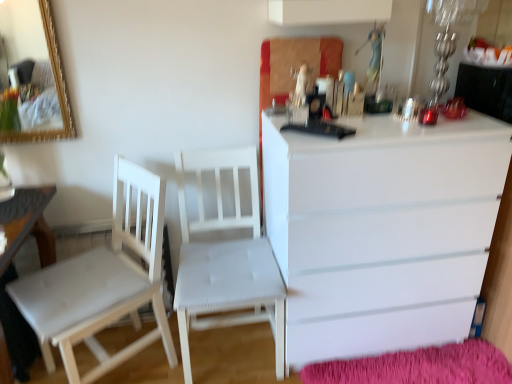
Question: Is white wood chair at center, arranged as the first chair when viewed from the left, positioned beyond the bounds of white fabric chair at center, the 1th chair from the right?

Choices:
 (A) no
 (B) yes

Answer: (B)

Question: Is white wood chair at center, arranged as the first chair when viewed from the left, bigger than white fabric chair at center, acting as the 2th chair starting from the left?

Choices:
 (A) yes
 (B) no

Answer: (A)

Question: From the image's perspective, is white wood chair at center, which is the 2th chair in right-to-left order, under white fabric chair at center, acting as the 2th chair starting from the left?

Choices:
 (A) yes
 (B) no

Answer: (A)

Question: Is the position of white wood chair at center, which is the 2th chair in right-to-left order, less distant than that of white fabric chair at center, the 1th chair from the right?

Choices:
 (A) yes
 (B) no

Answer: (A)

Question: From a real-world perspective, does white wood chair at center, arranged as the first chair when viewed from the left, sit lower than white fabric chair at center, the 1th chair from the right?

Choices:
 (A) no
 (B) yes

Answer: (B)

Question: Is white wood chair at center, which is the 2th chair in right-to-left order, not close to white fabric chair at center, acting as the 2th chair starting from the left?

Choices:
 (A) no
 (B) yes

Answer: (A)

Question: Does white glossy chest of drawers at right have a greater height compared to white wood chair at center, which is the 2th chair in right-to-left order?

Choices:
 (A) no
 (B) yes

Answer: (B)

Question: Can you confirm if white glossy chest of drawers at right is smaller than white wood chair at center, which is the 2th chair in right-to-left order?

Choices:
 (A) no
 (B) yes

Answer: (A)

Question: From a real-world perspective, is white glossy chest of drawers at right positioned over white wood chair at center, arranged as the first chair when viewed from the left, based on gravity?

Choices:
 (A) yes
 (B) no

Answer: (A)

Question: Considering the relative positions of white glossy chest of drawers at right and white wood chair at center, which is the 2th chair in right-to-left order, in the image provided, is white glossy chest of drawers at right to the left of white wood chair at center, which is the 2th chair in right-to-left order, from the viewer's perspective?

Choices:
 (A) no
 (B) yes

Answer: (A)

Question: Can you confirm if white glossy chest of drawers at right is positioned to the right of white wood chair at center, which is the 2th chair in right-to-left order?

Choices:
 (A) no
 (B) yes

Answer: (B)

Question: Is white glossy chest of drawers at right directly adjacent to white wood chair at center, arranged as the first chair when viewed from the left?

Choices:
 (A) no
 (B) yes

Answer: (A)

Question: Can you confirm if white wood table at lower left is positioned to the left of white wood chair at center, which is the 2th chair in right-to-left order?

Choices:
 (A) no
 (B) yes

Answer: (B)